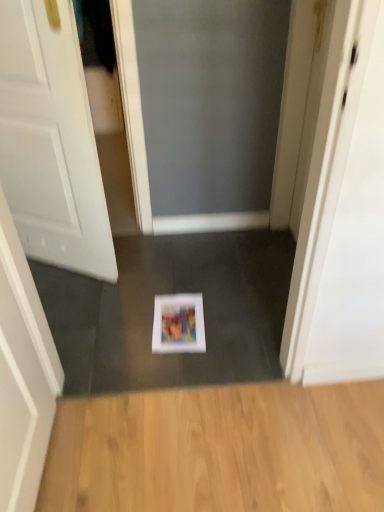
Find the location of a particular element. The height and width of the screenshot is (512, 384). vacant space situated above matte paper magazine at center (from a real-world perspective) is located at coordinates (179, 323).